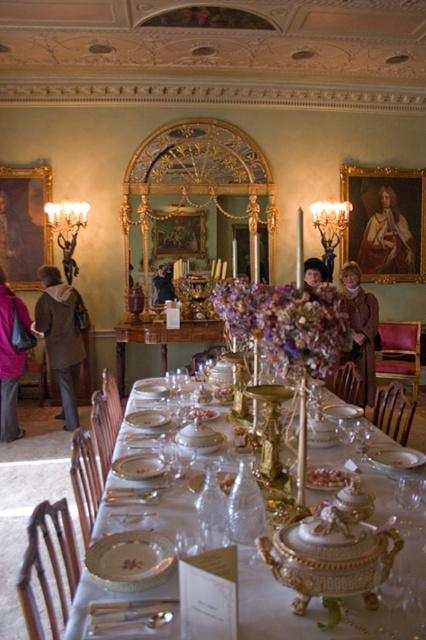
Is smooth red velvet portrait at upper right positioned before pink fabric coat at left?

No, it is not.

Can you confirm if smooth red velvet portrait at upper right is smaller than pink fabric coat at left?

Indeed, smooth red velvet portrait at upper right has a smaller size compared to pink fabric coat at left.

Find the location of a particular element. smooth red velvet portrait at upper right is located at coordinates (386, 237).

Locate an element on the screen. smooth red velvet portrait at upper right is located at coordinates (386, 237).

Does point (367, 625) come behind point (13, 413)?

No, it is in front of (13, 413).

Who is more distant from viewer, (250,582) or (0,301)?

The point (0,301) is more distant.

You are a GUI agent. You are given a task and a screenshot of the screen. Output one action in this format:
    pyautogui.click(x=<x>, y=<y>)
    Task: Click on the white porcelain table at center
    
    Given the screenshot: What is the action you would take?
    pyautogui.click(x=275, y=605)

Does matte gold frame at upper left have a smaller size compared to brown leather jacket at center?

Yes, matte gold frame at upper left is smaller than brown leather jacket at center.

Is matte gold frame at upper left above brown leather jacket at center?

Yes, matte gold frame at upper left is above brown leather jacket at center.

Is point (3, 260) positioned before point (322, 262)?

No, (3, 260) is further to viewer.

This screenshot has width=426, height=640. I want to click on matte gold frame at upper left, so pyautogui.click(x=11, y=241).